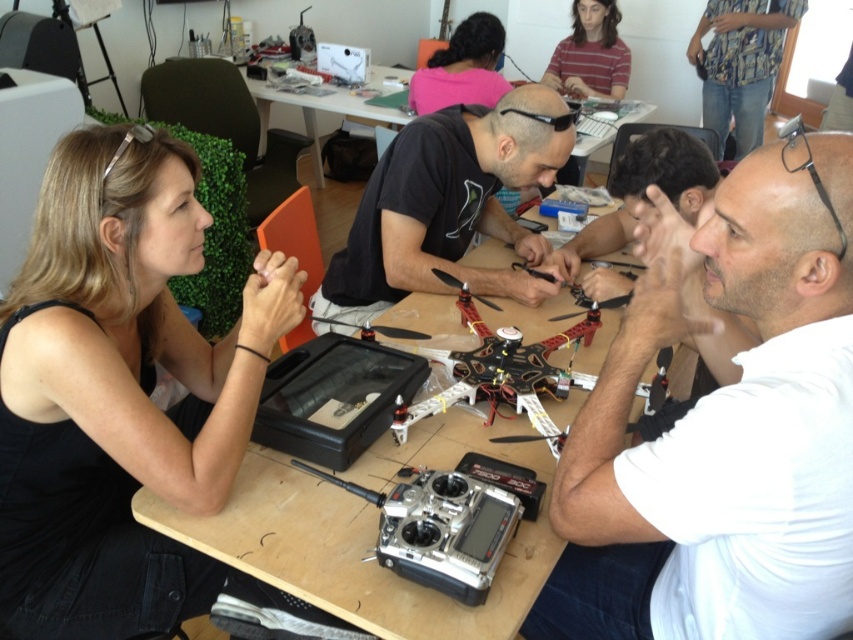
Question: Is black fabric at left to the right of striped shirt at upper center from the viewer's perspective?

Choices:
 (A) no
 (B) yes

Answer: (A)

Question: Among these points, which one is farthest from the camera?

Choices:
 (A) (62, 502)
 (B) (254, 481)

Answer: (A)

Question: Which point is closer to the camera taking this photo?

Choices:
 (A) (442, 92)
 (B) (73, 198)
 (C) (225, 550)
 (D) (410, 200)

Answer: (C)

Question: Is white matte shirt at center positioned behind pink fabric shirt at upper center?

Choices:
 (A) yes
 (B) no

Answer: (B)

Question: Considering the relative positions of black matte shirt at center and matte black drone at center in the image provided, where is black matte shirt at center located with respect to matte black drone at center?

Choices:
 (A) left
 (B) right

Answer: (A)

Question: Among these points, which one is nearest to the camera?

Choices:
 (A) [469, 88]
 (B) [648, 154]
 (C) [606, 93]

Answer: (B)